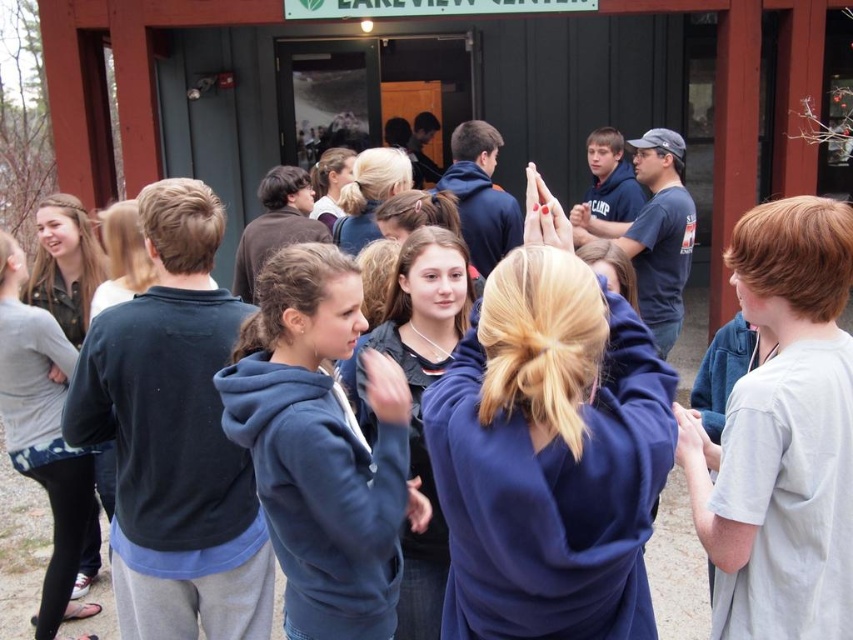
Question: Can you confirm if light gray cotton t-shirt at right is positioned below blue fleece jacket at center?

Choices:
 (A) no
 (B) yes

Answer: (A)

Question: Among these objects, which one is nearest to the camera?

Choices:
 (A) light gray cotton t-shirt at right
 (B) blue fleece jacket at center

Answer: (A)

Question: Can you confirm if light gray cotton t-shirt at right is smaller than blue fleece jacket at center?

Choices:
 (A) no
 (B) yes

Answer: (B)

Question: Does light gray cotton t-shirt at right appear under blue fleece jacket at center?

Choices:
 (A) no
 (B) yes

Answer: (A)

Question: Which object appears closest to the camera in this image?

Choices:
 (A) blue fleece jacket at center
 (B) light gray cotton t-shirt at right

Answer: (B)